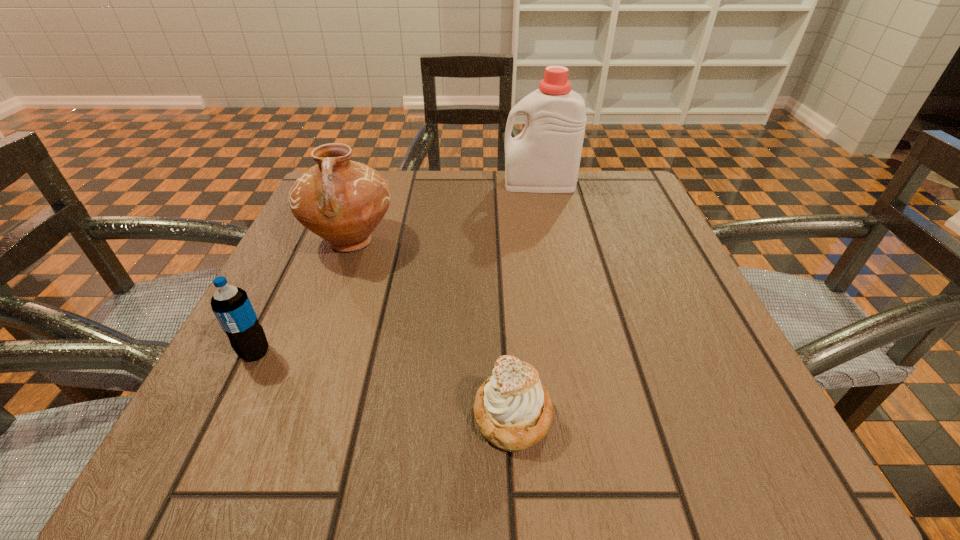
Identify the location of object positioned at the far left corner. (342, 201).

I want to click on object located at the far right corner, so click(x=545, y=157).

Where is `free region at the far edge of the desktop`? free region at the far edge of the desktop is located at coordinates tap(395, 200).

Identify the location of free space at the near edge of the desktop. The width and height of the screenshot is (960, 540). (589, 474).

In the image, there is a desktop. Where is `free space at the left edge`? The width and height of the screenshot is (960, 540). free space at the left edge is located at coordinates (305, 282).

In the image, there is a desktop. Identify the location of vacant area at the right edge. (635, 261).

Locate an element on the screen. vacant region at the near left corner of the desktop is located at coordinates (224, 414).

In the image, there is a desktop. Identify the location of vacant space at the far right corner. The height and width of the screenshot is (540, 960). (635, 178).

This screenshot has height=540, width=960. What are the coordinates of `free area in between the third nearest object and the second nearest object` in the screenshot? It's located at (303, 296).

The height and width of the screenshot is (540, 960). I want to click on unoccupied position between the second farthest object and the nearest object, so pos(432,328).